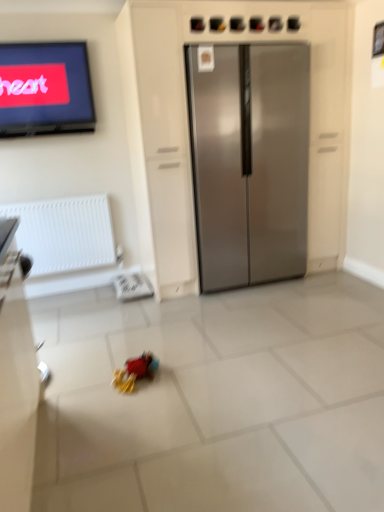
Question: Is white textured radiator at left aimed at stainless steel refrigerator at center?

Choices:
 (A) no
 (B) yes

Answer: (A)

Question: From a real-world perspective, is white textured radiator at left on top of stainless steel refrigerator at center?

Choices:
 (A) no
 (B) yes

Answer: (A)

Question: Is there a large distance between white textured radiator at left and stainless steel refrigerator at center?

Choices:
 (A) no
 (B) yes

Answer: (B)

Question: Considering the relative sizes of white textured radiator at left and stainless steel refrigerator at center in the image provided, is white textured radiator at left shorter than stainless steel refrigerator at center?

Choices:
 (A) yes
 (B) no

Answer: (A)

Question: Considering the relative sizes of white textured radiator at left and stainless steel refrigerator at center in the image provided, is white textured radiator at left taller than stainless steel refrigerator at center?

Choices:
 (A) no
 (B) yes

Answer: (A)

Question: Choose the correct answer: Is white textured radiator at left inside rubberized plastic toy at center or outside it?

Choices:
 (A) outside
 (B) inside

Answer: (A)

Question: Based on their positions, is white textured radiator at left located to the left or right of rubberized plastic toy at center?

Choices:
 (A) right
 (B) left

Answer: (B)

Question: Considering the positions of point (23, 243) and point (150, 352), is point (23, 243) closer or farther from the camera than point (150, 352)?

Choices:
 (A) closer
 (B) farther

Answer: (B)

Question: From their relative heights in the image, would you say white textured radiator at left is taller or shorter than rubberized plastic toy at center?

Choices:
 (A) tall
 (B) short

Answer: (A)

Question: Choose the correct answer: Is stainless steel refrigerator at center inside white textured radiator at left or outside it?

Choices:
 (A) outside
 (B) inside

Answer: (A)

Question: Based on their positions, is stainless steel refrigerator at center located to the left or right of white textured radiator at left?

Choices:
 (A) right
 (B) left

Answer: (A)

Question: Looking at the image, does stainless steel refrigerator at center seem bigger or smaller compared to white textured radiator at left?

Choices:
 (A) small
 (B) big

Answer: (B)

Question: Considering the positions of stainless steel refrigerator at center and white textured radiator at left in the image, is stainless steel refrigerator at center wider or thinner than white textured radiator at left?

Choices:
 (A) wide
 (B) thin

Answer: (A)

Question: Is rubberized plastic toy at center taller or shorter than stainless steel refrigerator at center?

Choices:
 (A) short
 (B) tall

Answer: (A)

Question: Based on their sizes in the image, would you say rubberized plastic toy at center is bigger or smaller than stainless steel refrigerator at center?

Choices:
 (A) small
 (B) big

Answer: (A)